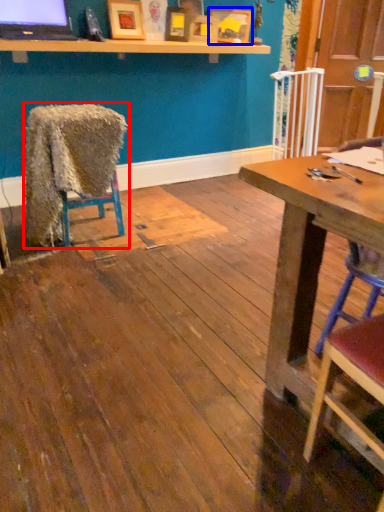
Question: Among these objects, which one is farthest to the camera, chair (highlighted by a red box) or picture frame (highlighted by a blue box)?

Choices:
 (A) chair
 (B) picture frame

Answer: (B)